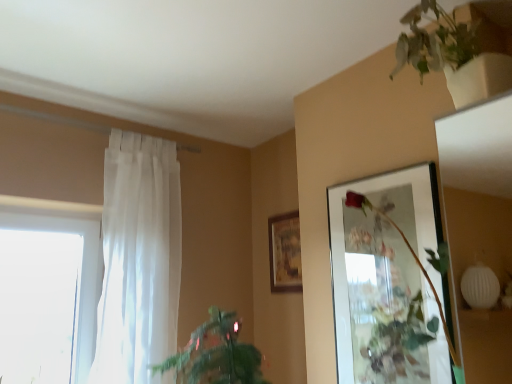
Question: Can you confirm if matte glass picture frame at upper right, positioned as the 1th picture frame in front-to-back order, is positioned to the left of green leafy plant at lower left, which appears as the second houseplant when viewed from the right?

Choices:
 (A) yes
 (B) no

Answer: (B)

Question: From a real-world perspective, is matte glass picture frame at upper right, positioned as the 1th picture frame in front-to-back order, located higher than green leafy plant at lower left, marked as the second houseplant in a top-to-bottom arrangement?

Choices:
 (A) yes
 (B) no

Answer: (A)

Question: Is matte glass picture frame at upper right, the 2th picture frame viewed from the left, not close to green leafy plant at lower left, which appears as the second houseplant when viewed from the right?

Choices:
 (A) yes
 (B) no

Answer: (B)

Question: Is the depth of matte glass picture frame at upper right, marked as the 1th picture frame in a right-to-left arrangement, less than that of green leafy plant at lower left, which appears as the second houseplant when viewed from the right?

Choices:
 (A) no
 (B) yes

Answer: (A)

Question: Can you confirm if matte glass picture frame at upper right, the 2th picture frame in the back-to-front sequence, is positioned to the right of green leafy plant at lower left, which appears as the second houseplant when viewed from the right?

Choices:
 (A) no
 (B) yes

Answer: (B)

Question: Considering the positions of point (159, 200) and point (297, 228), is point (159, 200) closer or farther from the camera than point (297, 228)?

Choices:
 (A) farther
 (B) closer

Answer: (B)

Question: Considering their positions, is white sheer curtain at left located in front of or behind wooden framed artwork at center, which is counted as the first picture frame, starting from the back?

Choices:
 (A) behind
 (B) front

Answer: (B)

Question: Is white sheer curtain at left inside the boundaries of wooden framed artwork at center, which is counted as the first picture frame, starting from the back, or outside?

Choices:
 (A) outside
 (B) inside

Answer: (A)

Question: From the image's perspective, is white sheer curtain at left located above or below wooden framed artwork at center, which is the 2th picture frame from right to left?

Choices:
 (A) below
 (B) above

Answer: (B)

Question: From their relative heights in the image, would you say green matte plant at upper right, which is counted as the first houseplant, starting from the right, is taller or shorter than matte glass picture frame at upper right, the 2th picture frame viewed from the left?

Choices:
 (A) short
 (B) tall

Answer: (A)

Question: From a real-world perspective, is green matte plant at upper right, which is the 2th houseplant from left to right, physically located above or below matte glass picture frame at upper right, the 2th picture frame in the back-to-front sequence?

Choices:
 (A) below
 (B) above

Answer: (B)

Question: Considering their positions, is green matte plant at upper right, which is counted as the first houseplant, starting from the right, located in front of or behind matte glass picture frame at upper right, marked as the 1th picture frame in a right-to-left arrangement?

Choices:
 (A) behind
 (B) front

Answer: (B)

Question: Is point (420, 29) positioned closer to the camera than point (420, 228)?

Choices:
 (A) farther
 (B) closer

Answer: (B)

Question: In terms of size, does white sheer curtain at left appear bigger or smaller than matte glass picture frame at upper right, marked as the 1th picture frame in a right-to-left arrangement?

Choices:
 (A) small
 (B) big

Answer: (B)

Question: Is white sheer curtain at left situated inside matte glass picture frame at upper right, positioned as the 1th picture frame in front-to-back order, or outside?

Choices:
 (A) outside
 (B) inside

Answer: (A)